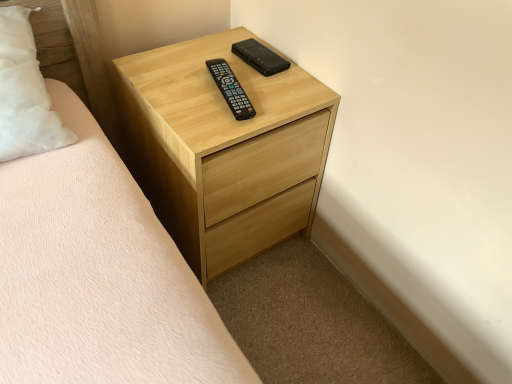
Question: Is black matte phone at upper center, the first control from the top, positioned with its back to light wood chest of drawers at center?

Choices:
 (A) yes
 (B) no

Answer: (A)

Question: Does black matte phone at upper center, arranged as the second control when ordered from the bottom, touch light wood chest of drawers at center?

Choices:
 (A) no
 (B) yes

Answer: (A)

Question: Is black matte phone at upper center, the first control from the top, not near light wood chest of drawers at center?

Choices:
 (A) no
 (B) yes

Answer: (A)

Question: Does black matte phone at upper center, which is the 2th control in front-to-back order, have a lesser width compared to light wood chest of drawers at center?

Choices:
 (A) yes
 (B) no

Answer: (A)

Question: Does black matte phone at upper center, arranged as the second control when ordered from the bottom, contain light wood chest of drawers at center?

Choices:
 (A) yes
 (B) no

Answer: (B)

Question: In the image, is light wood chest of drawers at center positioned in front of or behind black plastic remote at center, the first control from the front?

Choices:
 (A) front
 (B) behind

Answer: (A)

Question: In terms of width, does light wood chest of drawers at center look wider or thinner when compared to black plastic remote at center, the first control in the bottom-to-top sequence?

Choices:
 (A) wide
 (B) thin

Answer: (A)

Question: Is point (203, 132) closer or farther from the camera than point (222, 69)?

Choices:
 (A) farther
 (B) closer

Answer: (B)

Question: From the image's perspective, is light wood chest of drawers at center positioned above or below black plastic remote at center, the first control in the bottom-to-top sequence?

Choices:
 (A) below
 (B) above

Answer: (A)

Question: Is light wood chest of drawers at center inside the boundaries of black matte phone at upper center, acting as the 1th control starting from the back, or outside?

Choices:
 (A) inside
 (B) outside

Answer: (B)

Question: Is light wood chest of drawers at center to the left or to the right of black matte phone at upper center, which is the 2th control in front-to-back order, in the image?

Choices:
 (A) left
 (B) right

Answer: (A)

Question: Is light wood chest of drawers at center taller or shorter than black matte phone at upper center, which is the 2th control in front-to-back order?

Choices:
 (A) short
 (B) tall

Answer: (B)

Question: From the image's perspective, is light wood chest of drawers at center above or below black matte phone at upper center, arranged as the second control when ordered from the bottom?

Choices:
 (A) below
 (B) above

Answer: (A)

Question: Is point (244, 119) closer or farther from the camera than point (203, 41)?

Choices:
 (A) farther
 (B) closer

Answer: (B)

Question: From their relative heights in the image, would you say black plastic remote at center, the first control from the front, is taller or shorter than light wood chest of drawers at center?

Choices:
 (A) short
 (B) tall

Answer: (A)